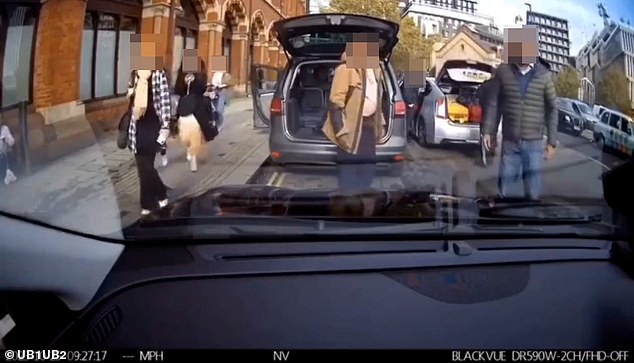
Locate an element on the screen. The image size is (634, 363). hotel is located at coordinates (444, 11).